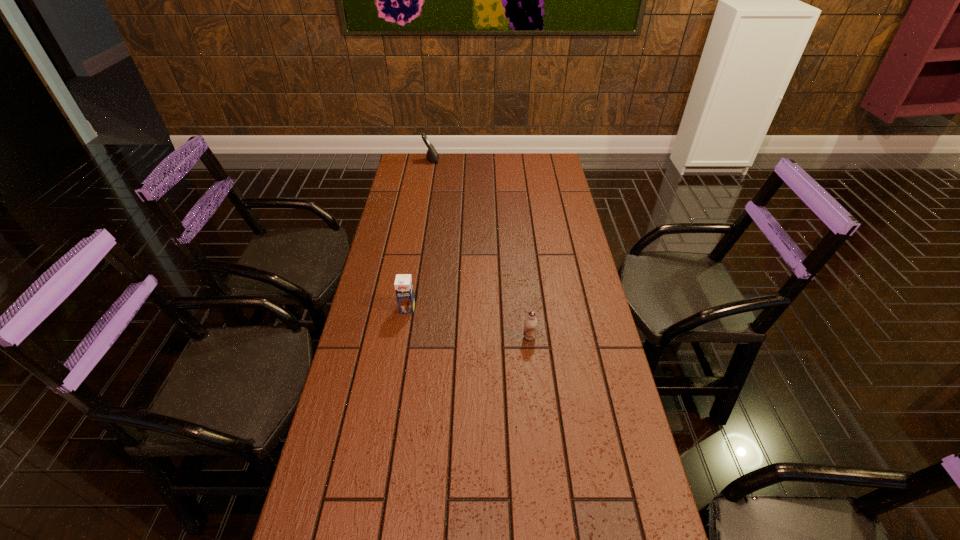
Where is `free space that satisfies the following two spatial constraints: 1. on the front label of the farther chocolate milk; 2. on the right side of the nearest object`? free space that satisfies the following two spatial constraints: 1. on the front label of the farther chocolate milk; 2. on the right side of the nearest object is located at coordinates (403, 337).

The height and width of the screenshot is (540, 960). In order to click on free space that satisfies the following two spatial constraints: 1. on the front-facing side of the nearest object; 2. on the left side of the cellular telephone in this screenshot , I will do `click(402, 337)`.

I want to click on free location that satisfies the following two spatial constraints: 1. on the front-facing side of the cellular telephone; 2. on the back side of the rightmost object, so click(x=402, y=337).

Find the location of a particular element. Image resolution: width=960 pixels, height=540 pixels. free location that satisfies the following two spatial constraints: 1. on the front label of the left chocolate milk; 2. on the right side of the shortest object is located at coordinates pos(403,337).

In order to click on free location that satisfies the following two spatial constraints: 1. on the front-facing side of the shorter chocolate milk; 2. on the right side of the farthest object in this screenshot , I will do `click(402, 337)`.